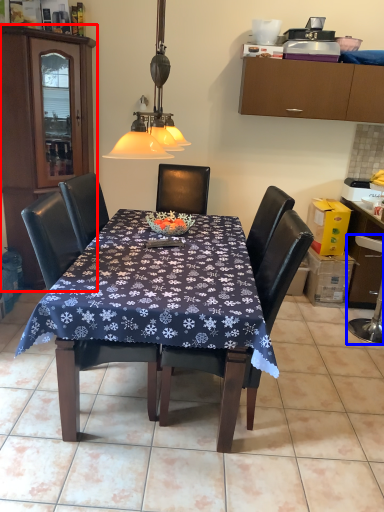
Question: Among these objects, which one is nearest to the camera, cabinetry (highlighted by a red box) or swivel chair (highlighted by a blue box)?

Choices:
 (A) cabinetry
 (B) swivel chair

Answer: (A)